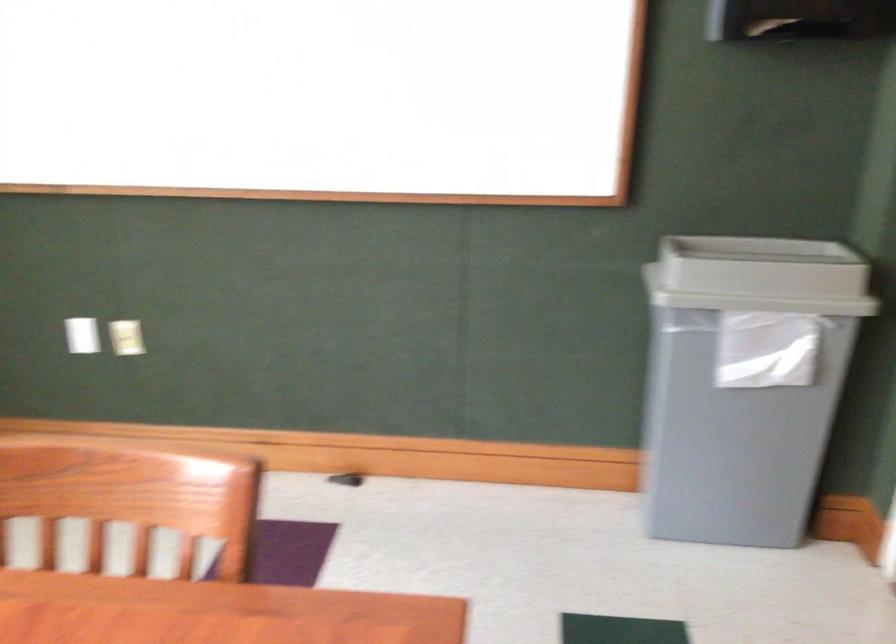
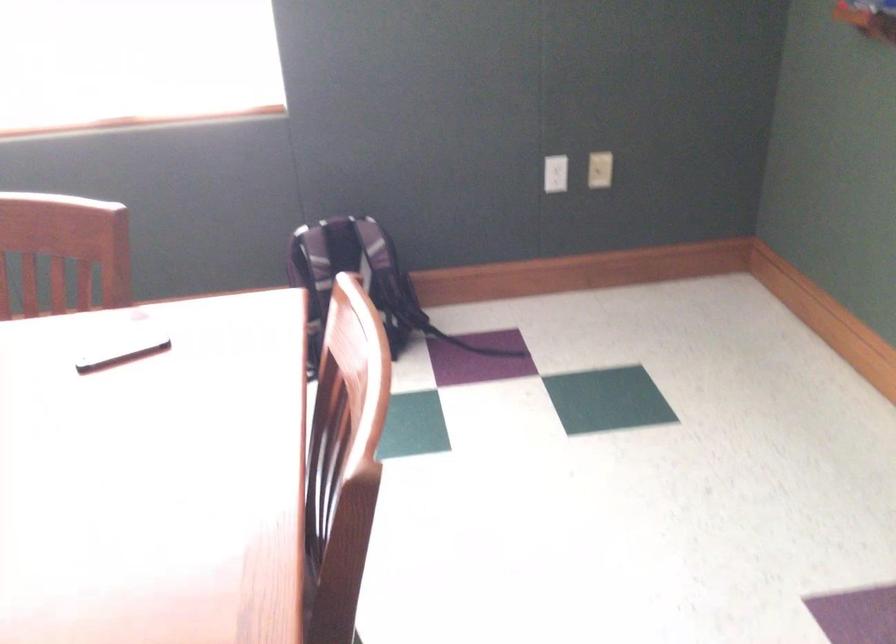
The images are taken continuously from a first-person perspective. In which direction is your viewpoint rotating?

The camera rotated toward left-down.